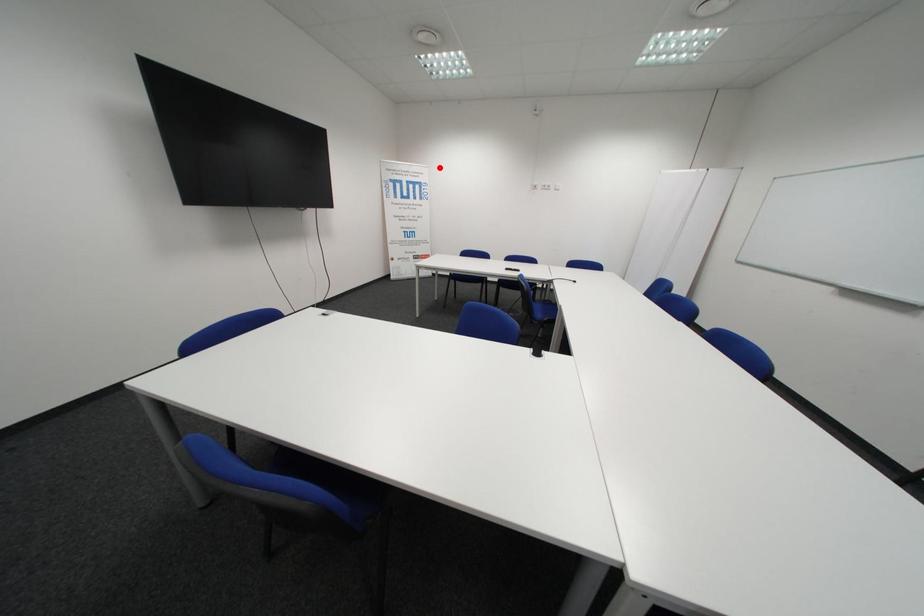
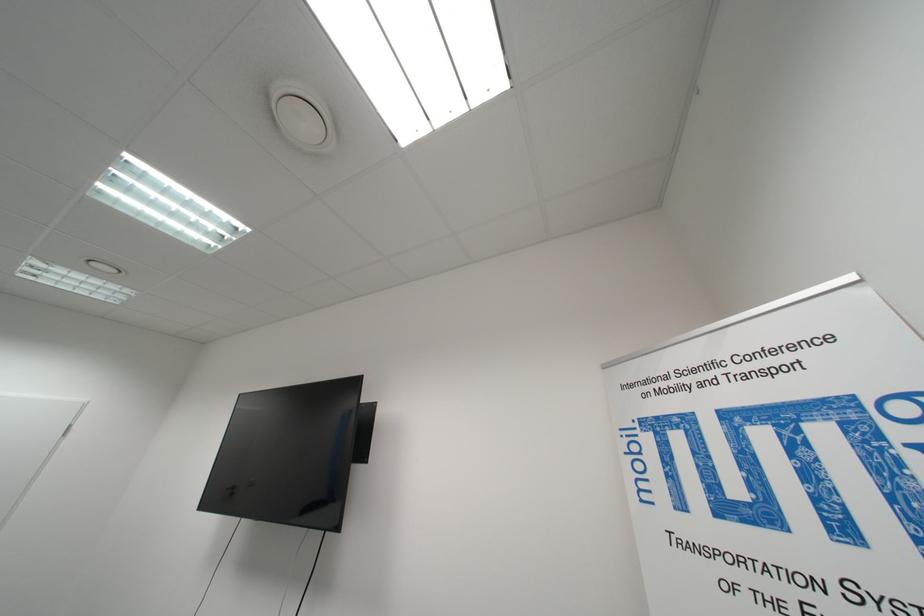
Question: I am providing you with two images of the same scene from different viewpoints. Image1 has a red point marked. In image2, the corresponding 3D location appears at what relative position? Reply with the corresponding letter.

Choices:
 (A) Closer
 (B) Farther

Answer: (B)